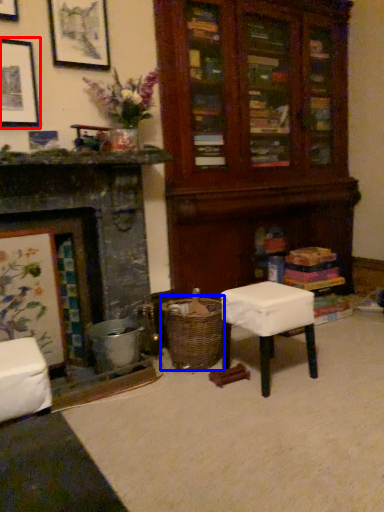
Question: Which object appears closest to the camera in this image, picture frame (highlighted by a red box) or crate (highlighted by a blue box)?

Choices:
 (A) picture frame
 (B) crate

Answer: (A)